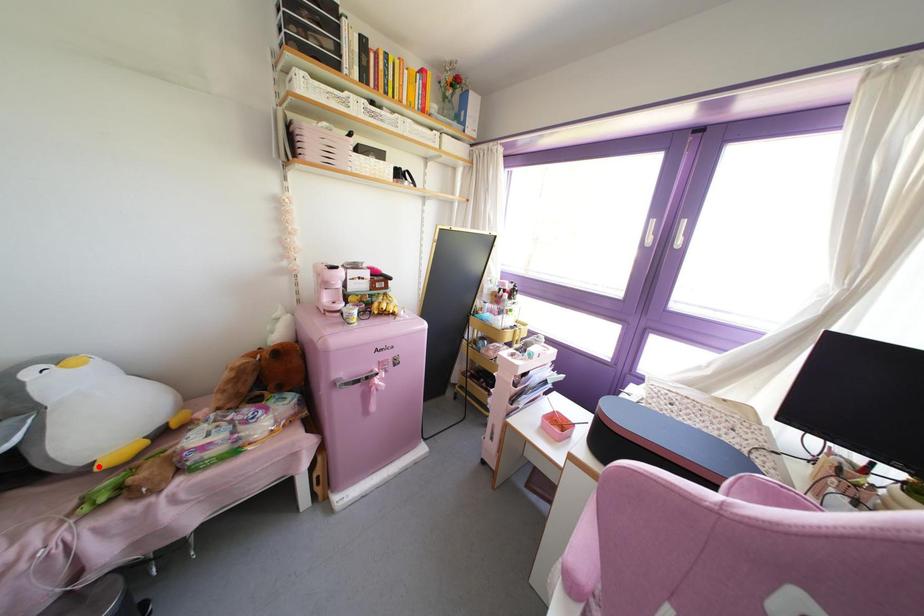
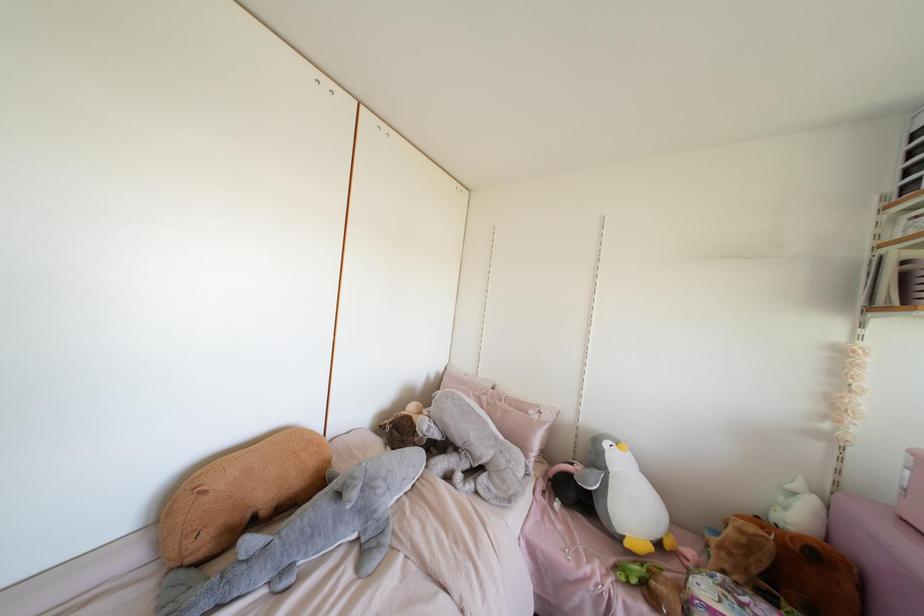
Locate, in the second image, the point that corresponds to the highlighted location in the first image.

(626, 544)